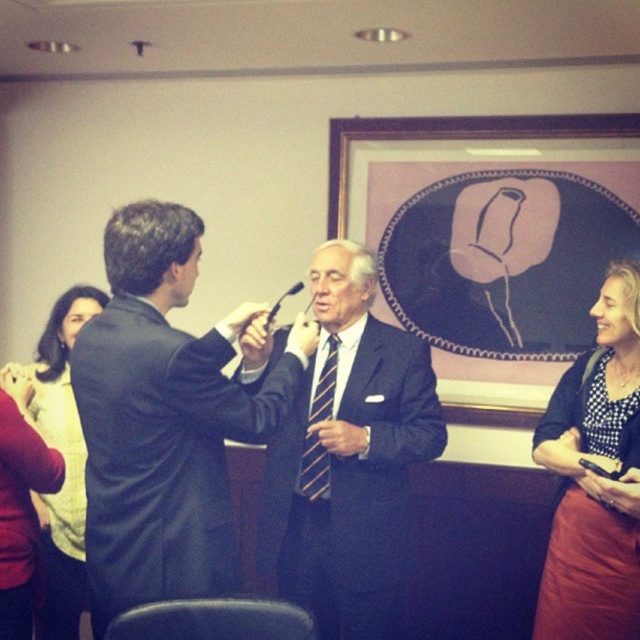
Question: Can you confirm if matte yellow sweater at upper left is thinner than striped fabric tie at center?

Choices:
 (A) no
 (B) yes

Answer: (A)

Question: Which object is positioned farthest from the striped fabric tie at center?

Choices:
 (A) matte black frame at center
 (B) polka dot blouse at right
 (C) dark blue suit at center
 (D) dark suit at center

Answer: (A)

Question: Is dark blue suit at center thinner than polka dot blouse at right?

Choices:
 (A) yes
 (B) no

Answer: (B)

Question: Which of the following is the closest to the observer?

Choices:
 (A) (64, 308)
 (B) (544, 573)
 (C) (333, 301)
 (D) (556, 230)

Answer: (C)

Question: Estimate the real-world distances between objects in this image. Which object is farther from the matte black frame at center?

Choices:
 (A) matte yellow sweater at upper left
 (B) striped fabric tie at center
 (C) polka dot blouse at right

Answer: (A)

Question: Does dark blue suit at center appear over striped fabric tie at center?

Choices:
 (A) yes
 (B) no

Answer: (B)